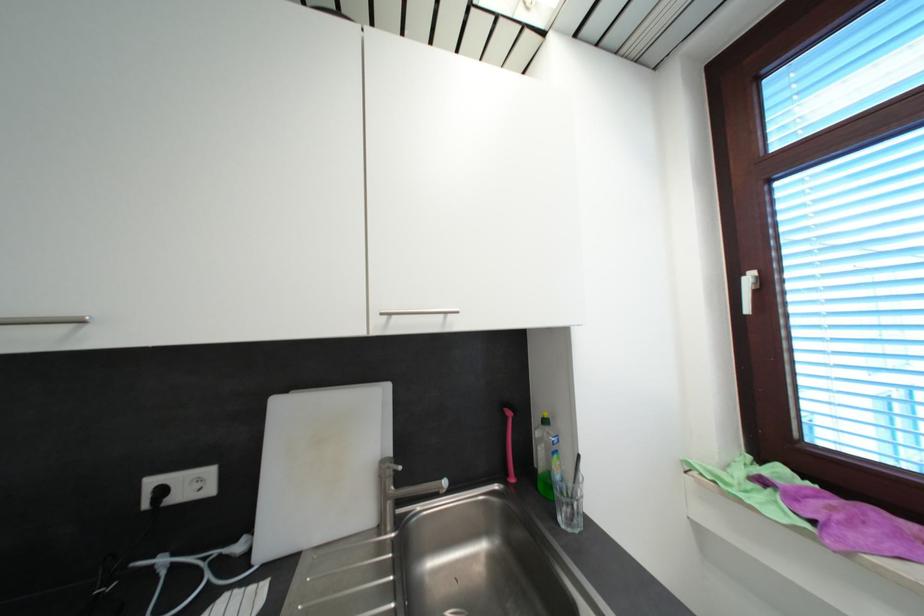
This screenshot has width=924, height=616. In order to click on faucet handle in this screenshot , I will do `click(391, 461)`.